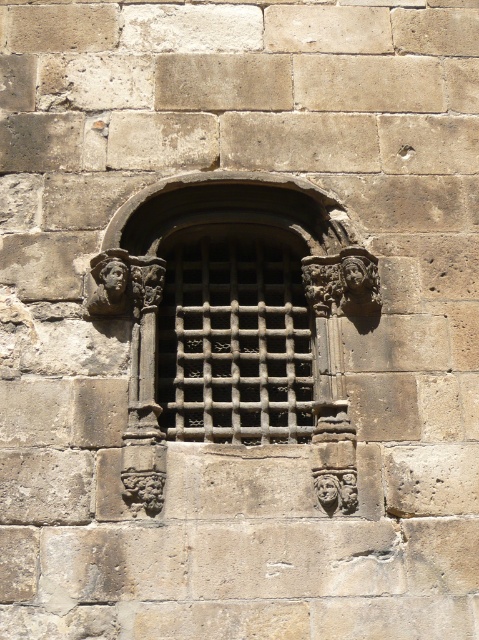
Question: Which point is farther to the camera?

Choices:
 (A) matte stone face at left
 (B) wooden lattice window at center

Answer: (A)

Question: Is wooden lattice window at center positioned at the back of matte stone face at left?

Choices:
 (A) no
 (B) yes

Answer: (A)

Question: Does wooden lattice window at center appear over matte stone face at left?

Choices:
 (A) yes
 (B) no

Answer: (B)

Question: Is wooden lattice window at center further to the viewer compared to matte stone face at left?

Choices:
 (A) no
 (B) yes

Answer: (A)